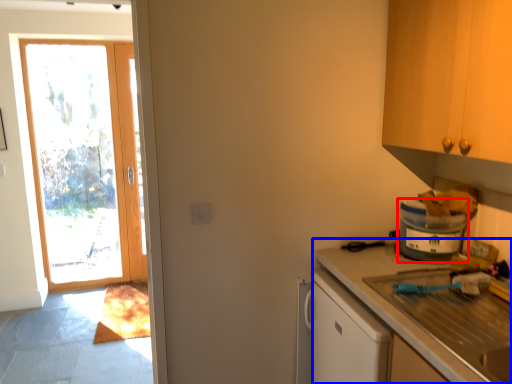
Question: Which object appears farthest to the camera in this image, appliance (highlighted by a red box) or countertop (highlighted by a blue box)?

Choices:
 (A) appliance
 (B) countertop

Answer: (A)